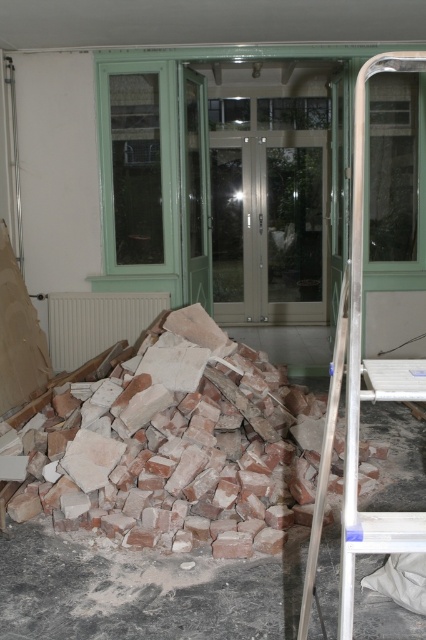
Measure the distance between brick rubble at lower left and clear glass door at center.

They are 4.58 meters apart.

Does brick rubble at lower left have a lesser width compared to clear glass door at center?

Incorrect, brick rubble at lower left's width is not less than clear glass door at center's.

Is point (131, 428) positioned in front of point (247, 298)?

Yes.

The height and width of the screenshot is (640, 426). In order to click on brick rubble at lower left in this screenshot , I will do `click(175, 452)`.

Does clear glass door at center appear on the right side of silver metallic ladder at right?

Correct, you'll find clear glass door at center to the right of silver metallic ladder at right.

Is clear glass door at center smaller than silver metallic ladder at right?

Actually, clear glass door at center might be larger than silver metallic ladder at right.

The width and height of the screenshot is (426, 640). In order to click on clear glass door at center in this screenshot , I will do `click(267, 228)`.

Locate an element on the screen. The image size is (426, 640). clear glass door at center is located at coordinates (267, 228).

Can you confirm if brick rubble at lower left is positioned to the right of silver metallic ladder at right?

No, brick rubble at lower left is not to the right of silver metallic ladder at right.

Between point (238, 474) and point (356, 289), which one is positioned in front?

Point (356, 289) is more forward.

The width and height of the screenshot is (426, 640). I want to click on brick rubble at lower left, so click(175, 452).